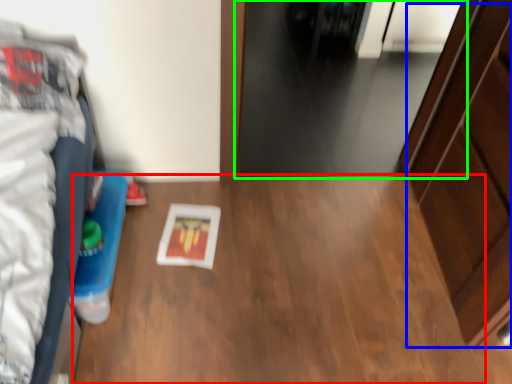
Question: Estimate the real-world distances between objects in this image. Which object is closer to table (highlighted by a red box), dresser (highlighted by a blue box) or door (highlighted by a green box)?

Choices:
 (A) dresser
 (B) door

Answer: (A)